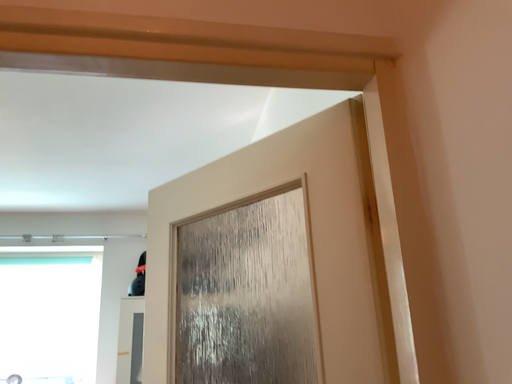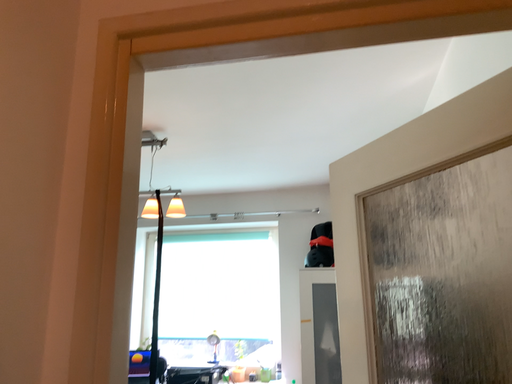
Question: Which way did the camera rotate in the video?

Choices:
 (A) rotated left
 (B) rotated right

Answer: (A)